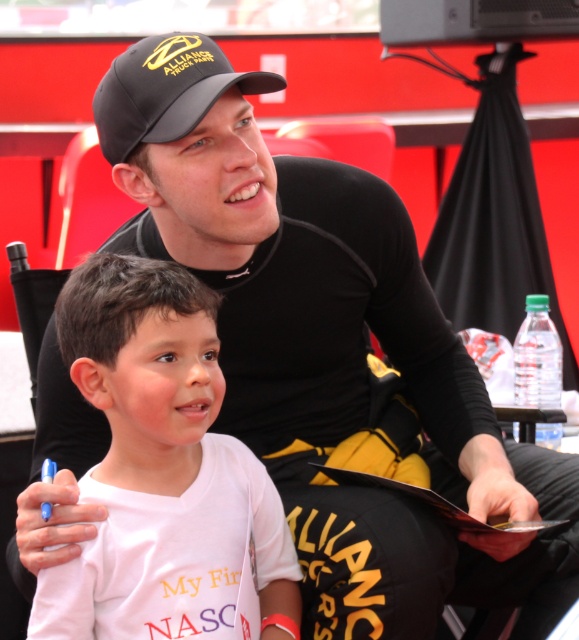
Question: Is white cotton shirt at lower left below black matte baseball cap at upper center?

Choices:
 (A) yes
 (B) no

Answer: (A)

Question: Does white cotton shirt at lower left appear over black matte baseball cap at upper center?

Choices:
 (A) yes
 (B) no

Answer: (B)

Question: Which point is farther to the camera?

Choices:
 (A) white cotton shirt at lower left
 (B) black matte baseball cap at upper center

Answer: (B)

Question: From the image, what is the correct spatial relationship of white cotton shirt at lower left in relation to black matte baseball cap at upper center?

Choices:
 (A) right
 (B) left

Answer: (B)